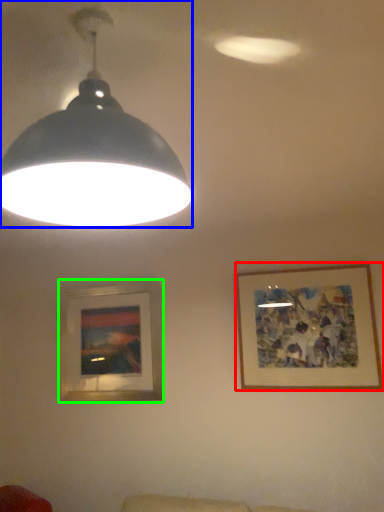
Question: Considering the real-world distances, which object is farthest from picture frame (highlighted by a red box)? lamp (highlighted by a blue box) or picture frame (highlighted by a green box)?

Choices:
 (A) lamp
 (B) picture frame

Answer: (A)